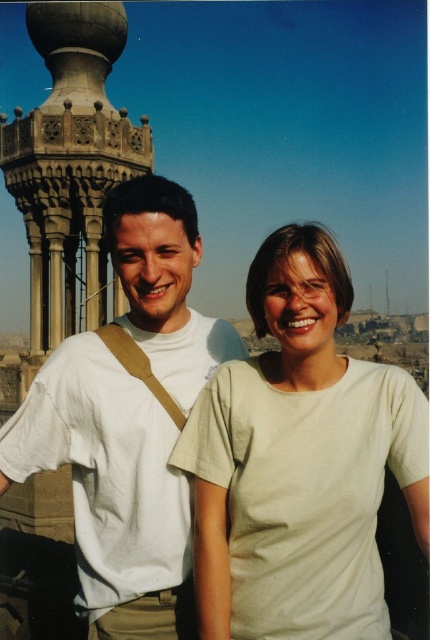
Can you confirm if white matte t-shirt at center is positioned below white cotton shirt at center?

Yes, white matte t-shirt at center is below white cotton shirt at center.

The width and height of the screenshot is (430, 640). What do you see at coordinates (300, 461) in the screenshot? I see `white matte t-shirt at center` at bounding box center [300, 461].

Find the location of a particular element. This screenshot has width=430, height=640. white matte t-shirt at center is located at coordinates (300, 461).